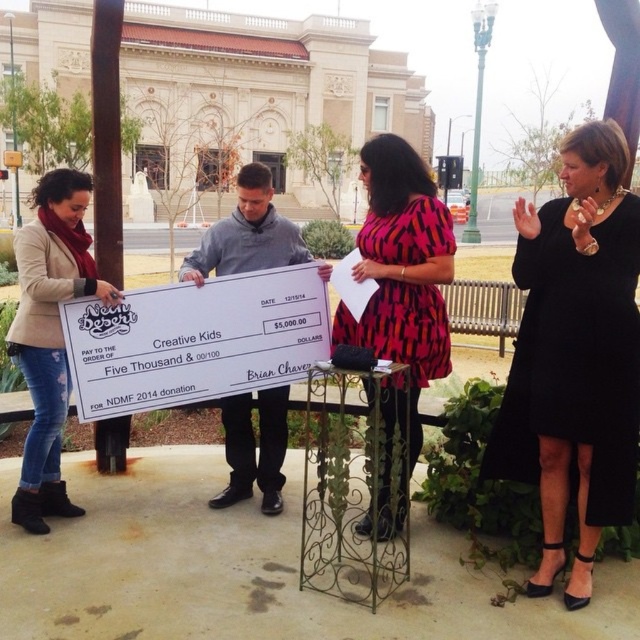
Based on the photo, does pink printed dress at center have a lesser width compared to matte beige blazer at left?

Correct, pink printed dress at center's width is less than matte beige blazer at left's.

Does pink printed dress at center appear on the left side of matte beige blazer at left?

In fact, pink printed dress at center is to the right of matte beige blazer at left.

Who is more forward, (378, 353) or (113, 285)?

Point (378, 353) is more forward.

Image resolution: width=640 pixels, height=640 pixels. What are the coordinates of `pink printed dress at center` in the screenshot? It's located at (401, 269).

Who is positioned more to the left, pink printed dress at center or gray fabric shirt at center?

Positioned to the left is gray fabric shirt at center.

Based on the photo, measure the distance from pink printed dress at center to gray fabric shirt at center.

A distance of 1.82 meters exists between pink printed dress at center and gray fabric shirt at center.

Find the location of a particular element. pink printed dress at center is located at coordinates (401, 269).

The height and width of the screenshot is (640, 640). I want to click on pink printed dress at center, so click(401, 269).

Between matte beige blazer at left and gray fabric shirt at center, which one is positioned higher?

gray fabric shirt at center is above.

Does point (49, 506) come in front of point (264, 248)?

Yes, it is in front of point (264, 248).

This screenshot has height=640, width=640. What do you see at coordinates (49, 333) in the screenshot? I see `matte beige blazer at left` at bounding box center [49, 333].

Identify the location of matte beige blazer at left. This screenshot has height=640, width=640. (49, 333).